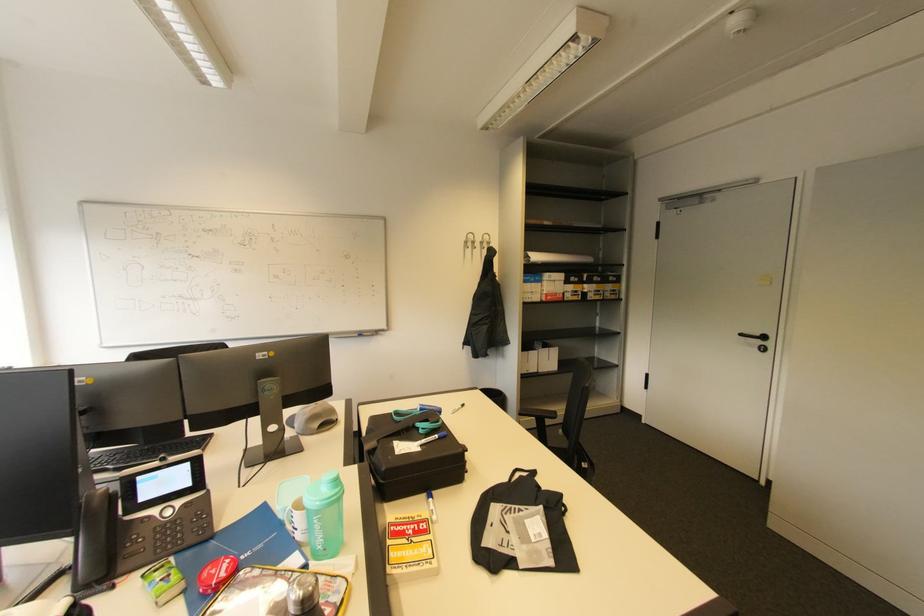
Describe the element at coordinates (561, 453) in the screenshot. I see `the chair sitting surface` at that location.